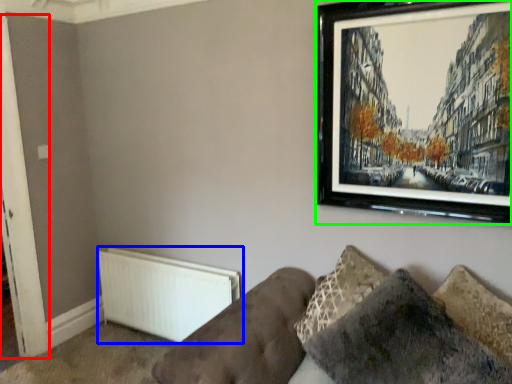
Question: Considering the real-world distances, which object is farthest from door (highlighted by a red box)? radiator (highlighted by a blue box) or picture frame (highlighted by a green box)?

Choices:
 (A) radiator
 (B) picture frame

Answer: (B)